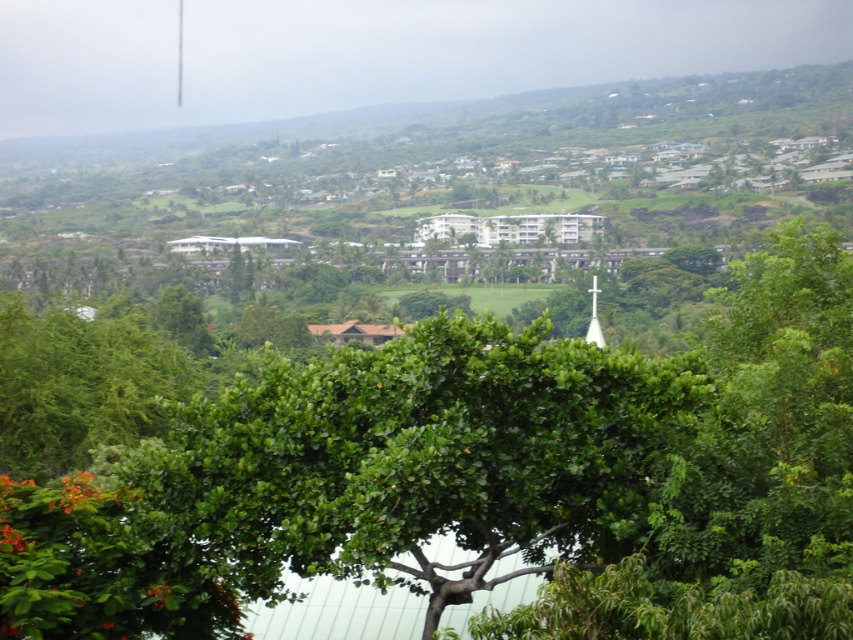
You are standing at the edge of the tropical landscape and want to take a photo of both the green leafy tree at center and the white glass spire at center. Which object should you point your camera towards first to capture both in the frame?

You should point your camera towards the green leafy tree at center first because it is positioned below the white glass spire at center, so adjusting the angle to include both would require framing from the lower part upwards.

You are a landscape architect planning to install a new lighting system. You need to determine if the green leafy tree at center will block the view of the white glass spire at center from the golf course area. Based on their heights, can the spire be seen above the tree?

The green leafy tree at center is not as tall as the white glass spire at center, so the spire can be seen above the tree from the golf course area.